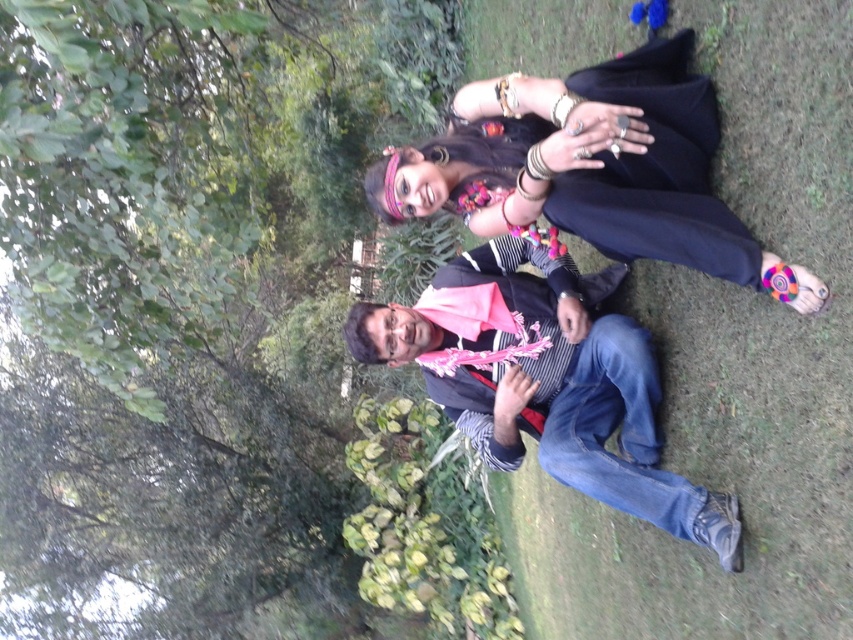
You are a photographer trying to capture a candid shot of the two people in the scene. You want to ensure that the black fabric dress at upper center and the striped fabric scarf at center are both visible in the frame. Based on their positions, which object should you focus on first to ensure both are in the shot?

The black fabric dress at upper center is located above the striped fabric scarf at center, so focusing on the dress first will help ensure both are included in the frame since it is positioned higher up.

You are standing in the natural setting shown in the image and want to place a small flag exactly at the point closer to you between point [575,122] and point [560,328]. Which coordinate should you choose?

Point [575,122] is closer to the viewer than point [560,328], so you should choose point [575,122] to place the flag.